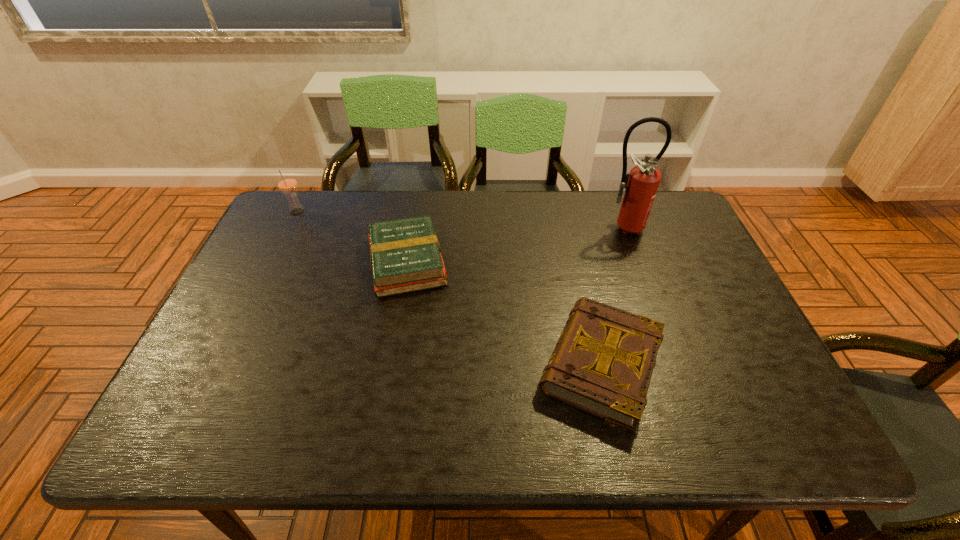
I want to click on fire extinguisher, so click(x=641, y=184).

At what (x,y) coordinates should I click in order to perform the action: click on straw. Please return your answer as a coordinate pair (x, y). The width and height of the screenshot is (960, 540). Looking at the image, I should click on (287, 183).

In order to click on the second tallest object in this screenshot , I will do `click(287, 183)`.

Find the location of a particular element. The width and height of the screenshot is (960, 540). the second object from left to right is located at coordinates (405, 254).

Find the location of a particular element. The width and height of the screenshot is (960, 540). the farther hardback book is located at coordinates (405, 254).

Locate an element on the screen. the nearer hardback book is located at coordinates (602, 364).

At what (x,y) coordinates should I click in order to perform the action: click on the right hardback book. Please return your answer as a coordinate pair (x, y). Image resolution: width=960 pixels, height=540 pixels. Looking at the image, I should click on (602, 364).

Where is `free space located at the nozzle of the fire extinguisher`? free space located at the nozzle of the fire extinguisher is located at coordinates (641, 280).

Identify the location of blank space located 0.140m on the front of the straw. The height and width of the screenshot is (540, 960). (280, 247).

Where is `free location located on the right of the farther hardback book`? The width and height of the screenshot is (960, 540). free location located on the right of the farther hardback book is located at coordinates (510, 262).